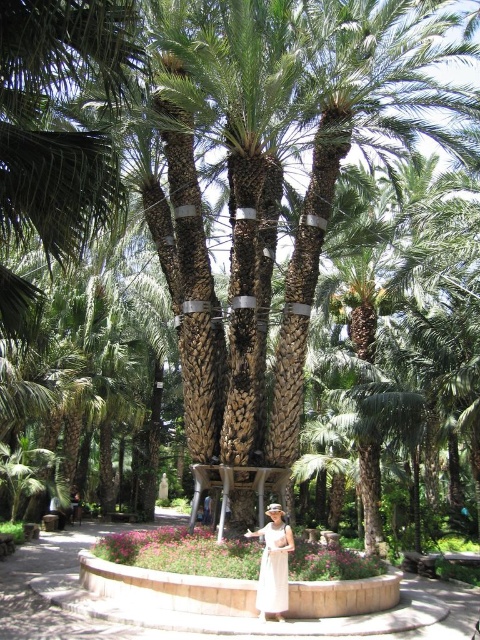
Question: Which point is closer to the camera?

Choices:
 (A) light beige fabric dress at center
 (B) white satin dress at center

Answer: (B)

Question: Can you confirm if light beige fabric dress at center is positioned to the right of white satin dress at center?

Choices:
 (A) no
 (B) yes

Answer: (A)

Question: Does light beige fabric dress at center come in front of white satin dress at center?

Choices:
 (A) no
 (B) yes

Answer: (A)

Question: In this image, where is light beige fabric dress at center located relative to white satin dress at center?

Choices:
 (A) right
 (B) left

Answer: (B)

Question: Which of the following is the closest to the observer?

Choices:
 (A) light beige fabric dress at center
 (B) white satin dress at center

Answer: (B)